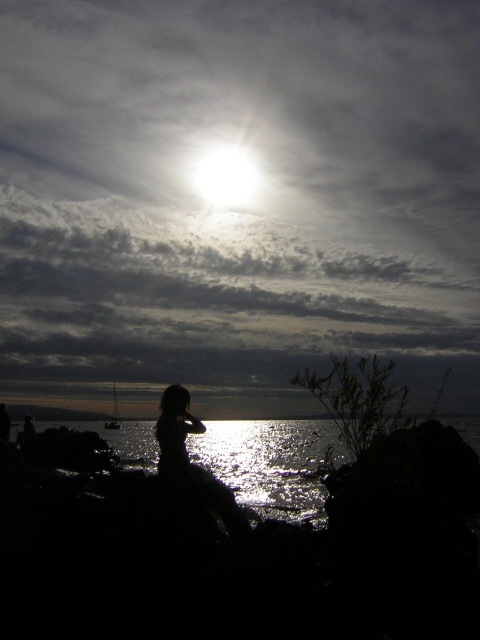
You are standing at the edge of the cliff overlooking the coast. You see the glistening reflective water at lower center and the bright white light at upper center. Which object is nearer to you?

The glistening reflective water at lower center is closer to the viewer than the bright white light at upper center.

You are standing at point A and want to walk towards the sun. There are two points marked on the map, point A at coordinates point (180, 394) and point B at coordinates point (263, 179). Which point is closer to your current position if you are facing the direction of the sun?

Point A at coordinates point (180, 394) is closer to your current position because it is in front of point B at coordinates point (263, 179) when facing the direction of the sun.

You are a photographer planning to take a photo of the glistening reflective water at lower center and the silhouette dress at center. Which object should you focus on first if you want to ensure both are in sharp focus, considering their relative sizes in the frame?

The glistening reflective water at lower center is taller than the silhouette dress at center, so focusing on the larger object first will help ensure both are in sharp focus.